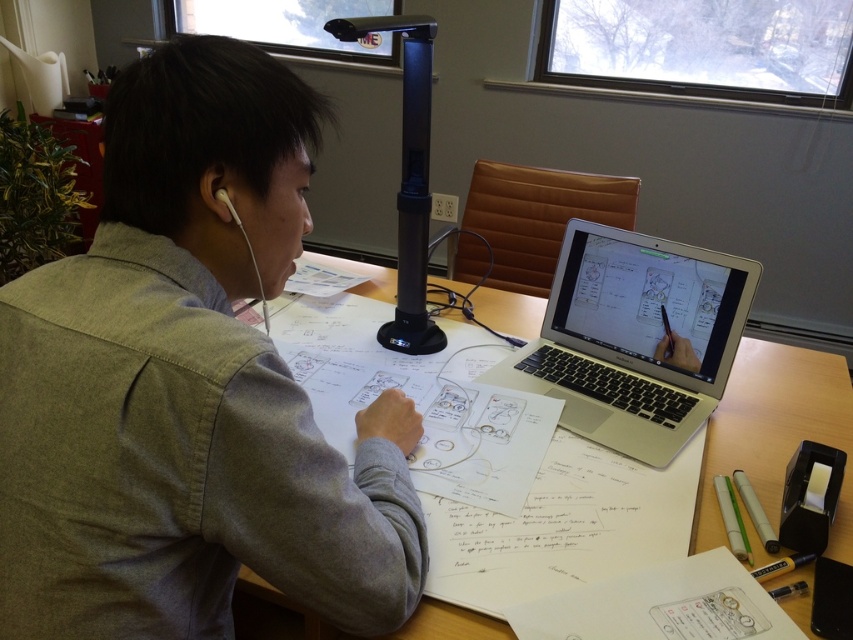
You are a delivery person who needs to place a protective cover on the silver metallic laptop at center and the white matte earphone at upper left. Which item requires a larger protective cover?

The silver metallic laptop at center requires a larger protective cover because it is larger in size than the white matte earphone at upper left.

You are a photographer trying to capture the person working at the desk. You want to ensure both the gray cotton shirt at center and the black plastic table lamp at center are clearly visible in the photo. Based on their positions, which object should you focus on first to ensure both are in frame?

The gray cotton shirt at center is positioned on the left side of black plastic table lamp at center. To ensure both are in frame, focus on the black plastic table lamp at center first since it is on the right, allowing the shirt to naturally fall into the left side of the frame.

Looking at this image, you are a photographer standing at a distance. You want to take a portrait of the person wearing the gray cotton shirt at center. What is the minimum distance you need to maintain to ensure the entire shirt is in frame?

The gray cotton shirt at center and viewer are 21.80 inches apart, so the minimum distance to maintain is 21.80 inches to ensure the entire shirt is in frame.